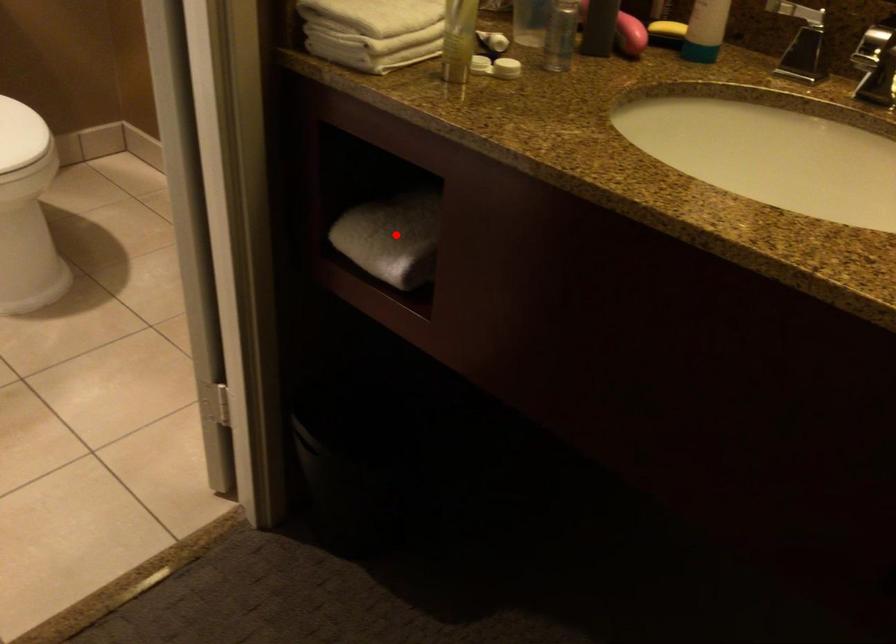
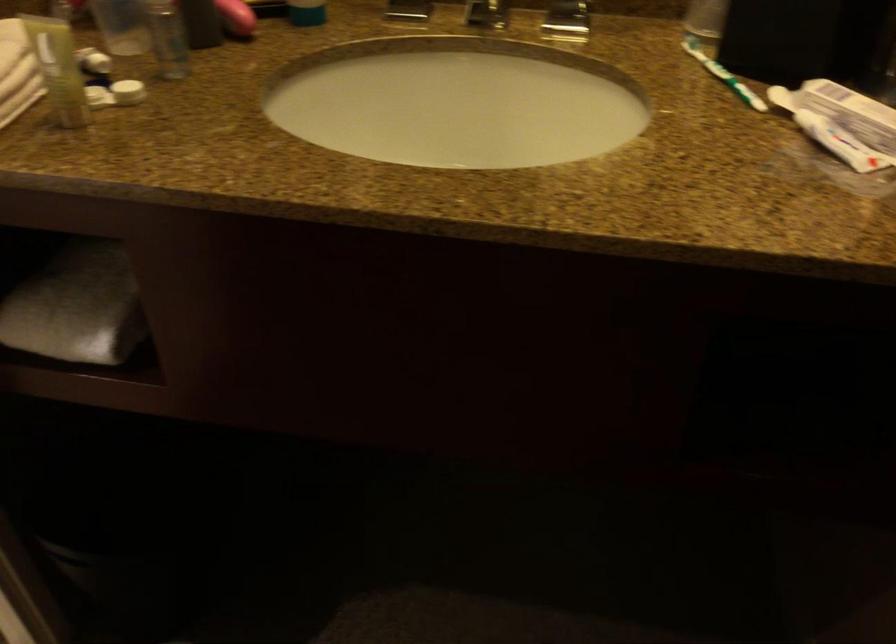
Question: A red point is marked in image1. In image2, is the corresponding 3D point closer to the camera or farther? Reply with the corresponding letter.

Choices:
 (A) The corresponding 3D point is closer.
 (B) The corresponding 3D point is farther.

Answer: (A)